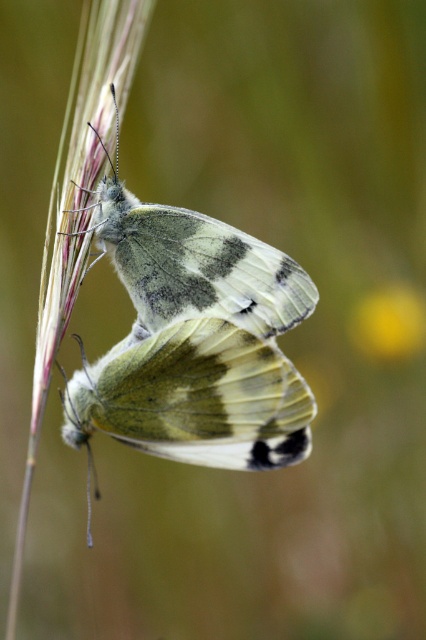
Question: Which object is farther from the camera taking this photo?

Choices:
 (A) translucent green wings at center
 (B) translucent white wings at center

Answer: (B)

Question: Can you confirm if translucent white wings at center is smaller than yellow matte flower at upper right?

Choices:
 (A) no
 (B) yes

Answer: (A)

Question: Which point is farther to the camera?

Choices:
 (A) yellow matte flower at upper right
 (B) translucent white wings at center
 (C) translucent green wings at center

Answer: (A)

Question: Where is translucent green wings at center located in relation to yellow matte flower at upper right in the image?

Choices:
 (A) above
 (B) below

Answer: (B)

Question: Among these objects, which one is farthest from the camera?

Choices:
 (A) yellow matte flower at upper right
 (B) translucent white wings at center

Answer: (A)

Question: Can you confirm if translucent white wings at center is smaller than yellow matte flower at upper right?

Choices:
 (A) yes
 (B) no

Answer: (B)